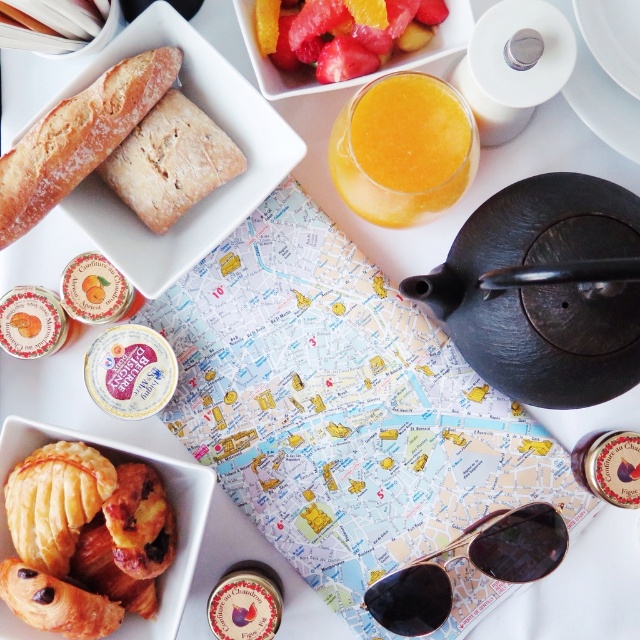
Question: Which object is closer to the camera taking this photo?

Choices:
 (A) orange translucent glass at center
 (B) brown crumbly square at upper left

Answer: (A)

Question: Which point is farther from the camera taking this photo?

Choices:
 (A) coord(28,435)
 (B) coord(493,529)
 (C) coord(170,125)

Answer: (B)

Question: Is black cast iron teapot at center right to the right of golden flaky pastry at lower left from the viewer's perspective?

Choices:
 (A) yes
 (B) no

Answer: (A)

Question: From the image, what is the correct spatial relationship of shiny orange slices at center in relation to white ceramic plate at upper right?

Choices:
 (A) right
 (B) left

Answer: (B)

Question: Estimate the real-world distances between objects in this image. Which object is closer to the golden brown crusty bread at upper left?

Choices:
 (A) gold metallic sunglasses at center
 (B) golden flaky croissant at lower left
 (C) brown crumbly square at upper left

Answer: (C)

Question: From the image, what is the correct spatial relationship of gold metallic sunglasses at center in relation to golden flaky pastry at lower left?

Choices:
 (A) left
 (B) right

Answer: (B)